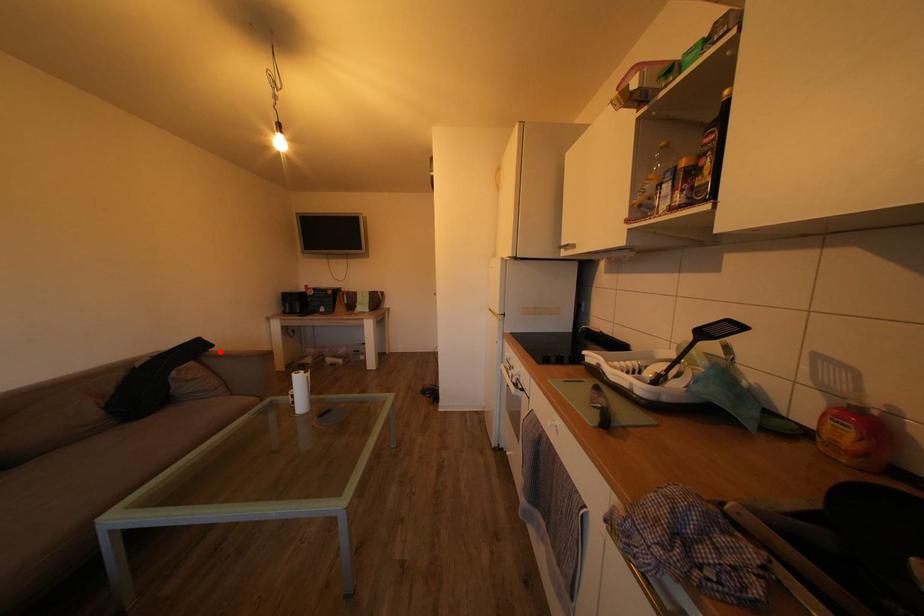
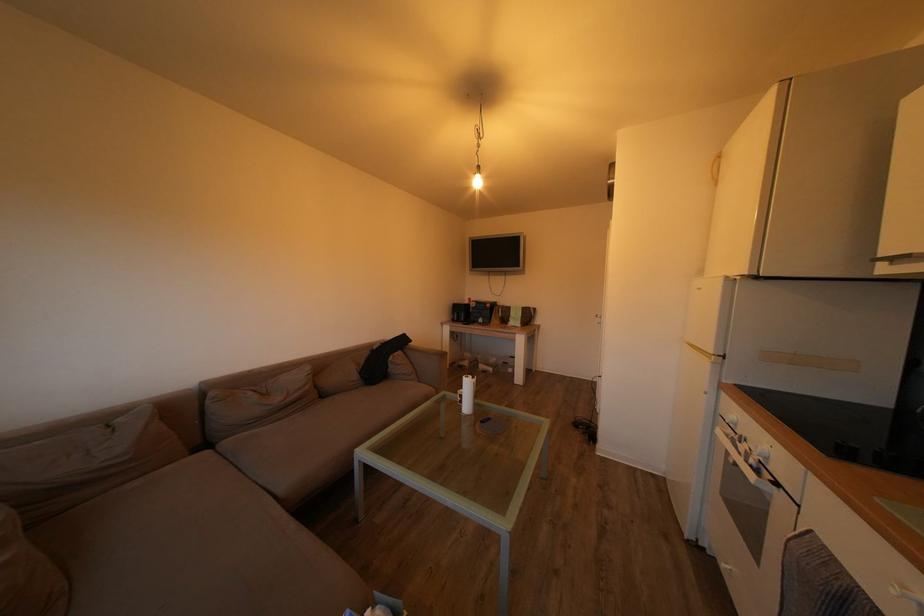
In the second image, find the point that corresponds to the highlighted location in the first image.

(419, 347)